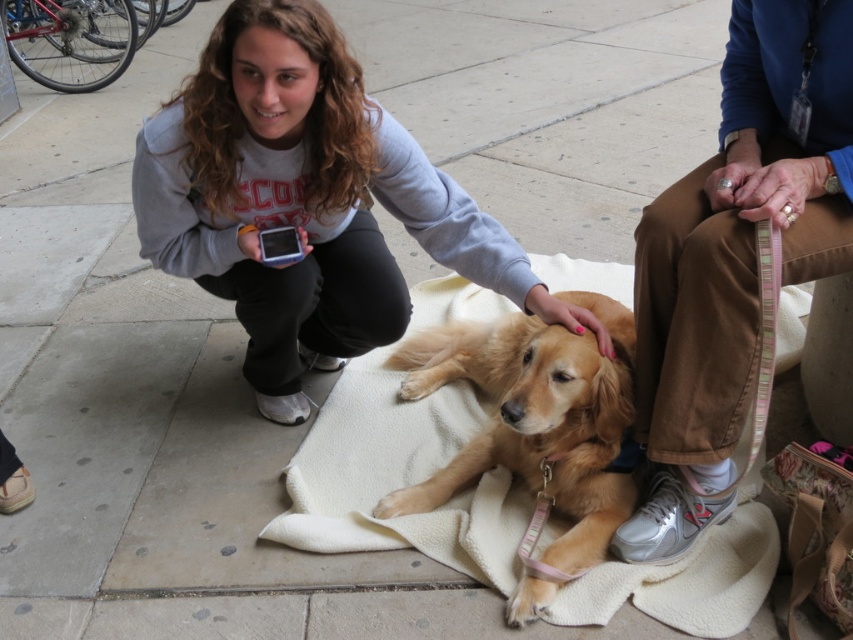
You are a photographer setting up a shot of the golden retriever lying on the white fleece blanket at center. The pink striped leash at lower right is partially obscuring the blanket. Can you adjust the leash so it doesn not cover the blanket?

The pink striped leash at lower right is positioned over white fleece blanket at center, so moving the leash away from the blanket would prevent it from covering the blanket.

You are a photographer setting up a tripod in the center of the scene. You need to place the matte gray sweatshirt at center and the white fleece blanket at center in your shot. Which object will appear wider in the photo?

The white fleece blanket at center will appear wider in the photo since it has a greater width than the matte gray sweatshirt at center according to the description.

You are a photographer setting up a tripod in the center of the scene. You need to place your equipment between the matte gray sweatshirt at center and the white fleece blanket at center. Which object should you move to make space?

The matte gray sweatshirt at center is to the left of the white fleece blanket at center, so you should move the matte gray sweatshirt at center to create space between them for the tripod.